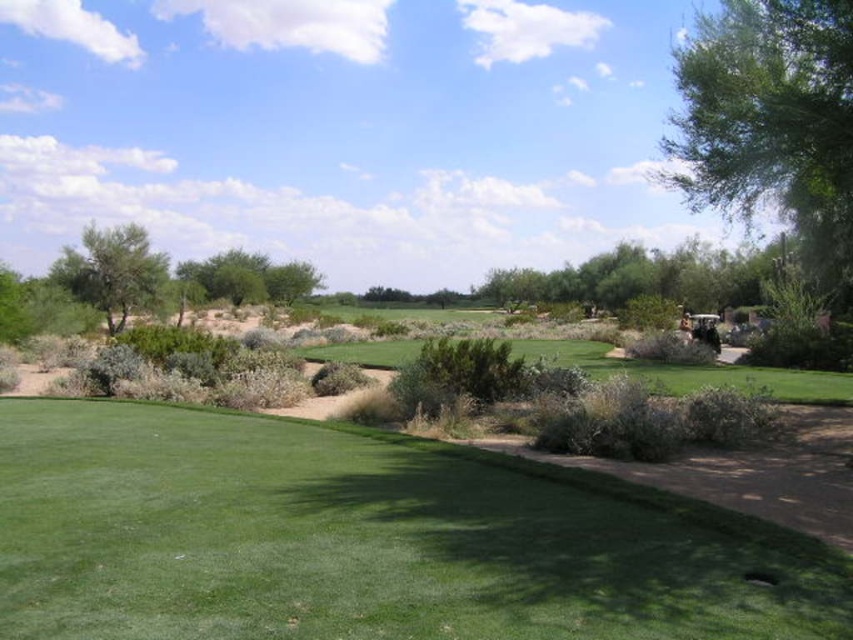
Is green leafy tree at upper right to the left of green leafy tree at center from the viewer's perspective?

Incorrect, green leafy tree at upper right is not on the left side of green leafy tree at center.

How much distance is there between green leafy tree at upper right and green leafy tree at center?

A distance of 125.74 feet exists between green leafy tree at upper right and green leafy tree at center.

In order to click on green leafy tree at upper right in this screenshot , I will do `click(772, 122)`.

Is green leafy tree at upper right shorter than green leafy tree at left?

In fact, green leafy tree at upper right may be taller than green leafy tree at left.

Can you confirm if green leafy tree at upper right is bigger than green leafy tree at left?

Yes, green leafy tree at upper right is bigger than green leafy tree at left.

You are a GUI agent. You are given a task and a screenshot of the screen. Output one action in this format:
    pyautogui.click(x=<x>, y=<y>)
    Task: Click on the green leafy tree at upper right
    
    Given the screenshot: What is the action you would take?
    pyautogui.click(x=772, y=122)

Where is `green leafy tree at upper right`? The height and width of the screenshot is (640, 853). green leafy tree at upper right is located at coordinates (772, 122).

Between point (56, 544) and point (849, 97), which one is positioned in front?

Point (56, 544)

Does green smooth grass at center lie in front of green leafy tree at upper right?

Yes.

Does point (611, 598) come closer to viewer compared to point (750, 120)?

Yes, it is.

The width and height of the screenshot is (853, 640). I want to click on green smooth grass at center, so click(x=364, y=540).